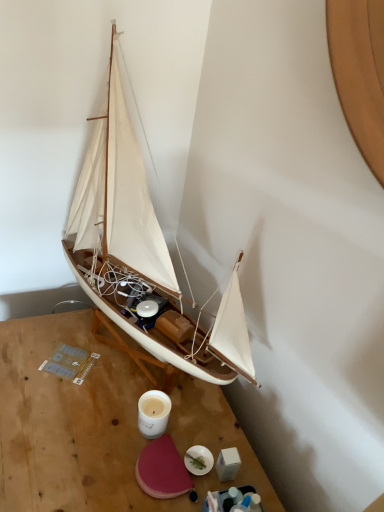
Describe the element at coordinates (98, 426) in the screenshot. I see `wooden table at center` at that location.

I want to click on wooden table at center, so click(x=98, y=426).

Locate an element on the screen. The image size is (384, 512). wooden table at center is located at coordinates (98, 426).